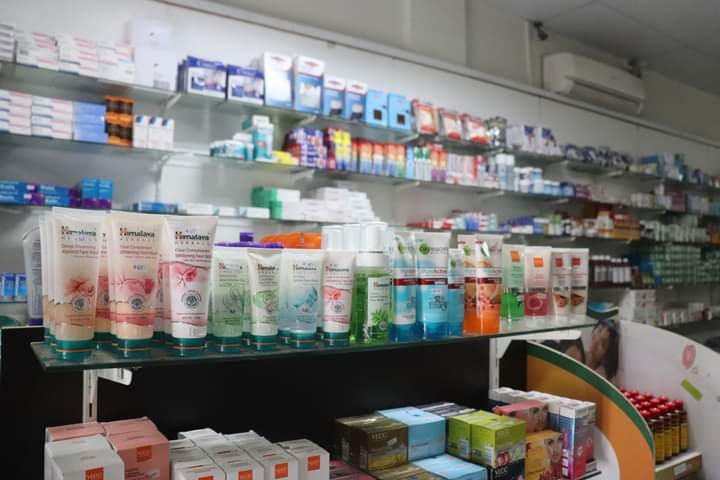
Where is `air conditioner`? Image resolution: width=720 pixels, height=480 pixels. air conditioner is located at coordinates (618, 96).